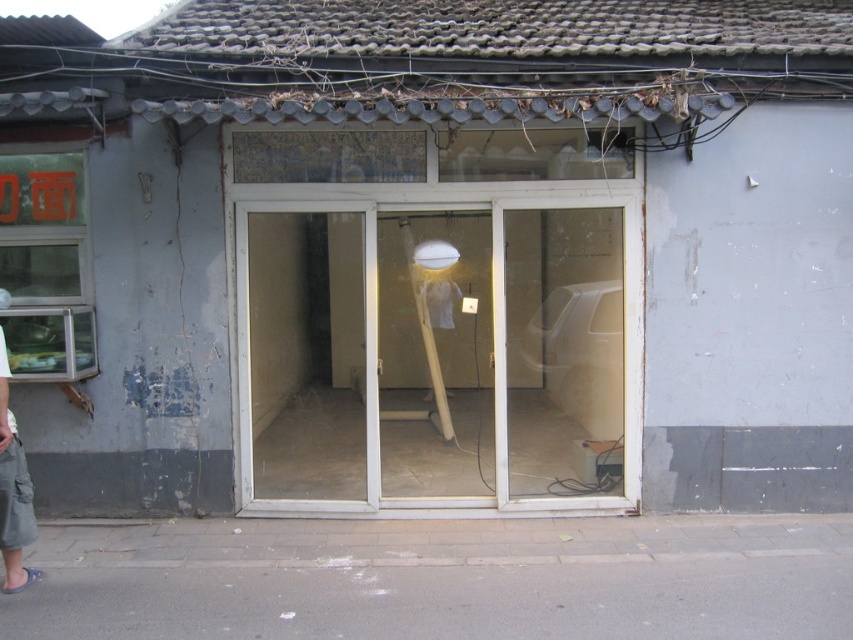
Is transparent glass door at center to the left of transparent plastic screen door at center from the viewer's perspective?

Yes, transparent glass door at center is to the left of transparent plastic screen door at center.

Which is behind, point (292, 444) or point (408, 305)?

Point (408, 305)

What do you see at coordinates (306, 355) in the screenshot? I see `transparent glass door at center` at bounding box center [306, 355].

What are the coordinates of `transparent glass door at center` in the screenshot? It's located at (306, 355).

Can you confirm if transparent plastic screen door at center is positioned below gray cotton skirt at lower left?

Actually, transparent plastic screen door at center is above gray cotton skirt at lower left.

Describe the element at coordinates (434, 356) in the screenshot. I see `transparent plastic screen door at center` at that location.

This screenshot has height=640, width=853. I want to click on transparent plastic screen door at center, so click(x=434, y=356).

Is transparent glass door at center to the right of gray cotton skirt at lower left from the viewer's perspective?

Yes, transparent glass door at center is to the right of gray cotton skirt at lower left.

Is transparent glass door at center above gray cotton skirt at lower left?

Correct, transparent glass door at center is located above gray cotton skirt at lower left.

You are a GUI agent. You are given a task and a screenshot of the screen. Output one action in this format:
    pyautogui.click(x=<x>, y=<y>)
    Task: Click on the transparent glass door at center
    This screenshot has width=853, height=640.
    Given the screenshot: What is the action you would take?
    pyautogui.click(x=306, y=355)